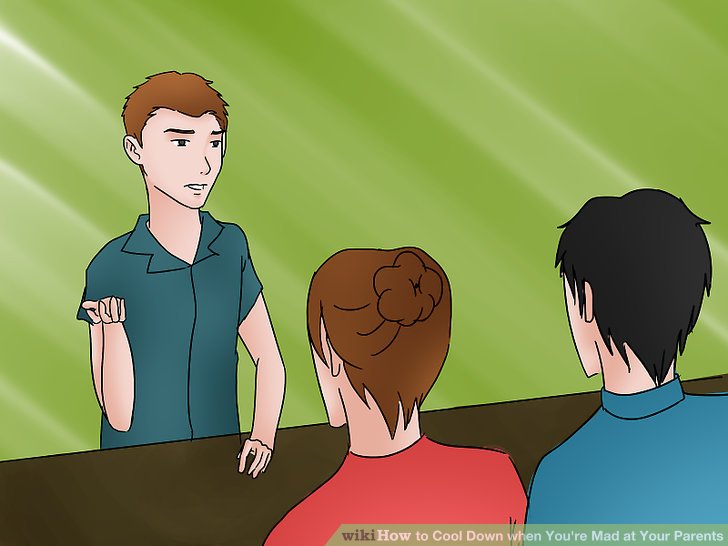
At what (x,y) coordinates should I click in order to perform the action: click on table. Please return your answer as a coordinate pair (x, y). The image size is (728, 546). Looking at the image, I should click on (199, 505).